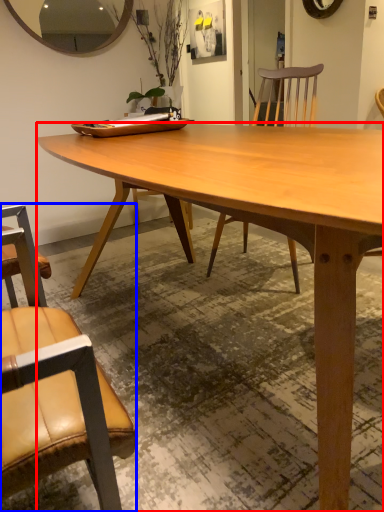
Question: Among these objects, which one is farthest to the camera, desk (highlighted by a red box) or chair (highlighted by a blue box)?

Choices:
 (A) desk
 (B) chair

Answer: (A)